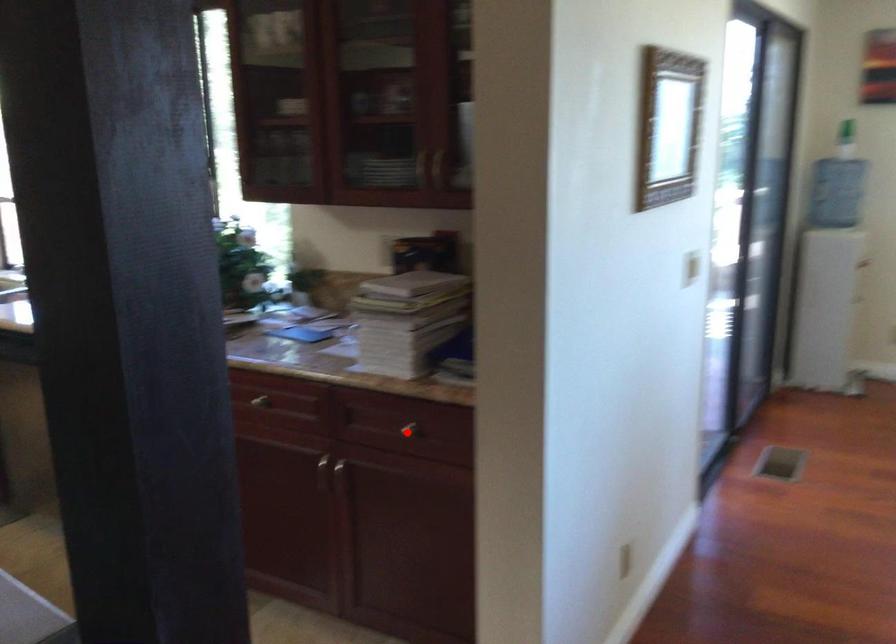
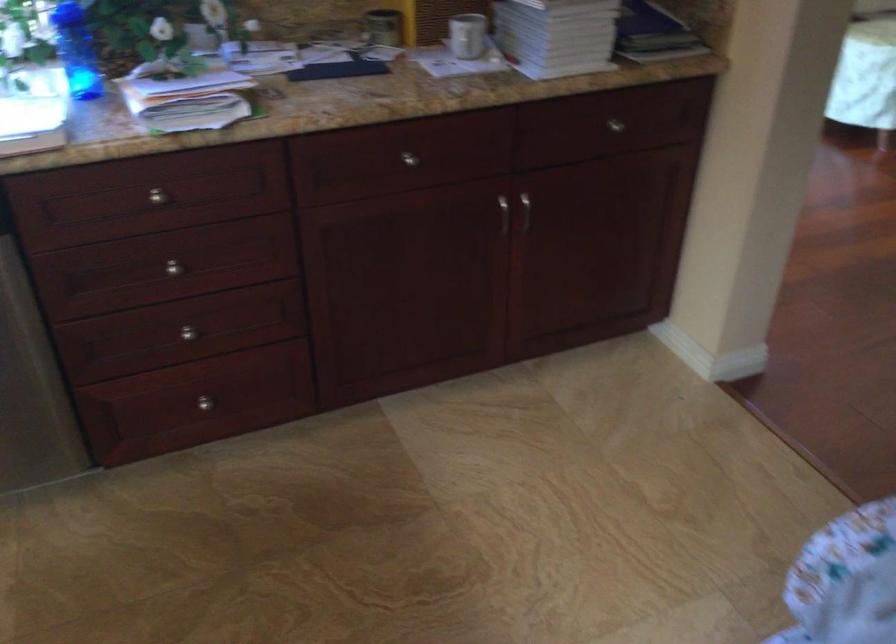
Question: I am providing you with two images of the same scene from different viewpoints. In image1, a red point is highlighted. Considering the same 3D point in image2, which of the following is correct?

Choices:
 (A) It is closer
 (B) It is farther

Answer: (A)